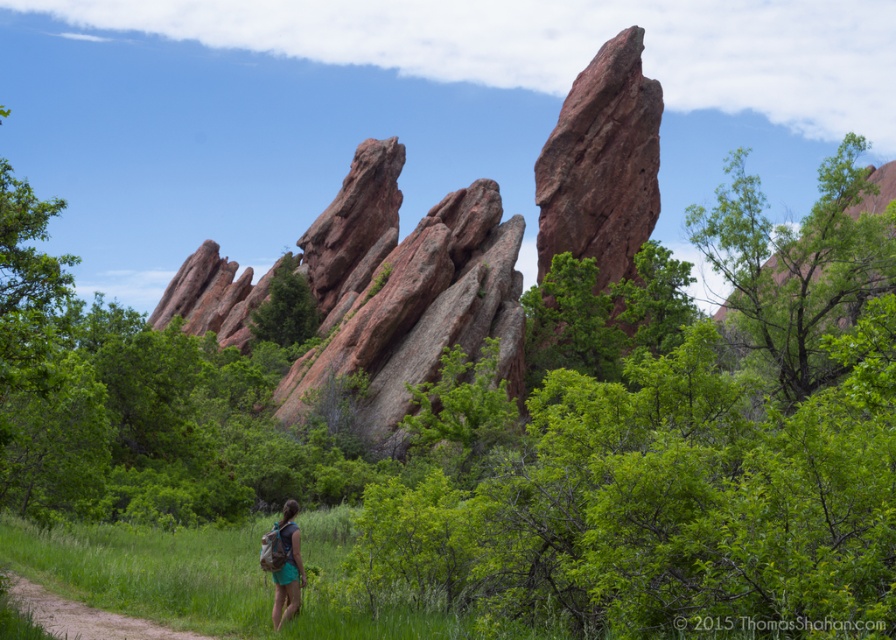
Between brown dirt path at lower left and matte green backpack at center, which one has less height?

brown dirt path at lower left is shorter.

At what (x,y) coordinates should I click in order to perform the action: click on brown dirt path at lower left. Please return your answer as a coordinate pair (x, y). Looking at the image, I should click on (85, 618).

Where is `brown dirt path at lower left`? The height and width of the screenshot is (640, 896). brown dirt path at lower left is located at coordinates (85, 618).

Which is behind, point (412, 381) or point (295, 593)?

The point (412, 381) is more distant.

Is reddish-brown rock formation at center positioned behind matte green backpack at center?

Yes, reddish-brown rock formation at center is further from the viewer.

Locate an element on the screen. Image resolution: width=896 pixels, height=640 pixels. reddish-brown rock formation at center is located at coordinates (405, 289).

Based on the photo, between reddish-brown rock formation at center and reddish-brown rock at center, which one has more height?

Standing taller between the two is reddish-brown rock formation at center.

Is point (356, 212) positioned after point (645, 237)?

Yes, point (356, 212) is farther from viewer.

Image resolution: width=896 pixels, height=640 pixels. I want to click on reddish-brown rock formation at center, so click(x=405, y=289).